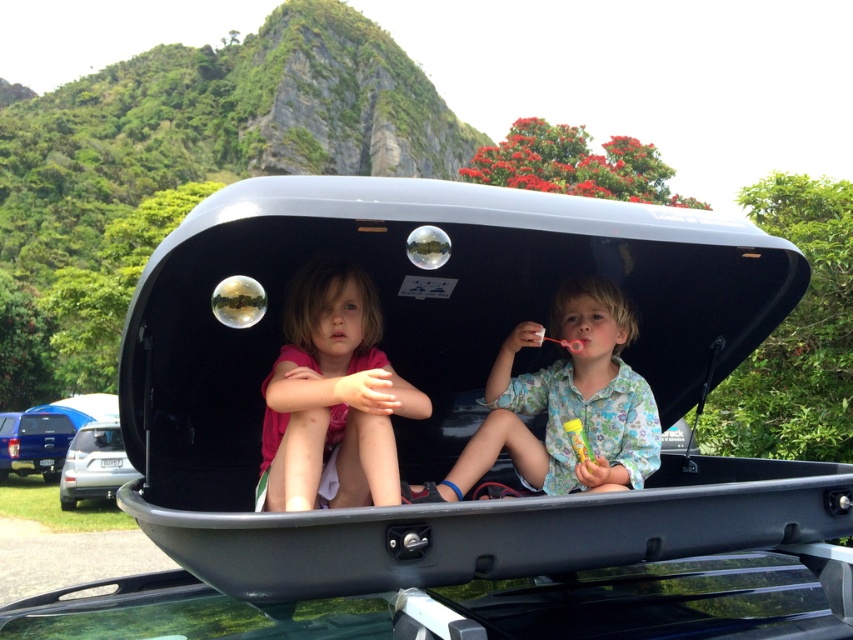
Question: Can you confirm if matte black cargo box at center is positioned to the right of satin silver suv at lower left?

Choices:
 (A) no
 (B) yes

Answer: (B)

Question: Is matte black cargo box at center smaller than satin silver suv at lower left?

Choices:
 (A) no
 (B) yes

Answer: (A)

Question: Which object is positioned closest to the floral fabric shirt at center?

Choices:
 (A) matte black cargo box at center
 (B) blue metallic truck at lower left
 (C) pink fabric at center
 (D) satin silver suv at lower left

Answer: (A)

Question: Considering the real-world distances, which object is closest to the blue metallic truck at lower left?

Choices:
 (A) satin silver suv at lower left
 (B) pink fabric at center

Answer: (A)

Question: Which object appears closest to the camera in this image?

Choices:
 (A) matte black cargo box at center
 (B) blue metallic truck at lower left

Answer: (A)

Question: Can you confirm if matte black cargo box at center is thinner than blue metallic truck at lower left?

Choices:
 (A) yes
 (B) no

Answer: (B)